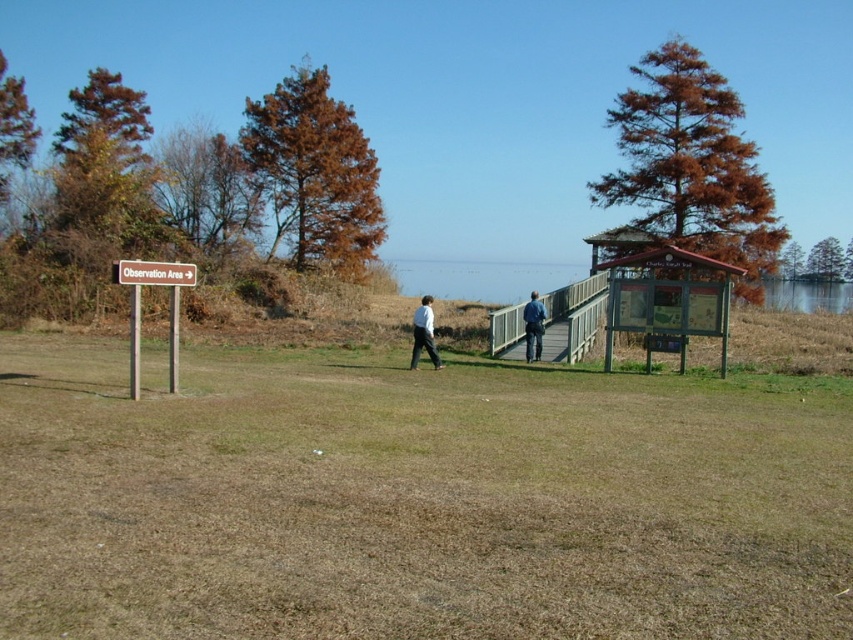
You are planning to place a rectangular banner between the brown wooden sign at left and the white matte shirt at center. The banner must be exactly as wide as the wider object. Which object should you use to determine the banner width?

The brown wooden sign at left is wider than the white matte shirt at center, so you should use the brown wooden sign at left to determine the banner width.

What does the point at coordinates (x=138, y=308) represent in the image?

The point at coordinates (x=138, y=308) indicates the location of the brown wooden sign at left.